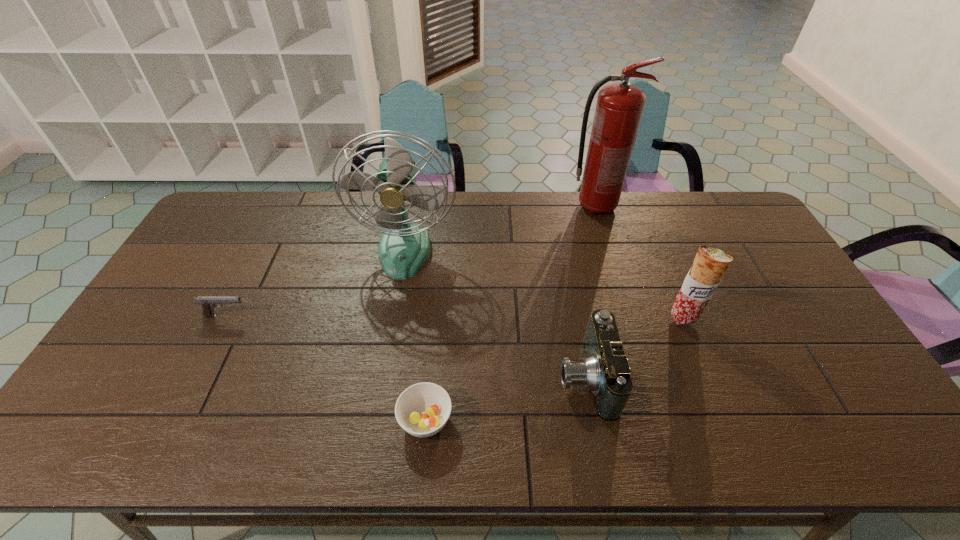
Identify the location of fire extinguisher. The width and height of the screenshot is (960, 540). (619, 108).

This screenshot has height=540, width=960. I want to click on the farthest object, so pyautogui.click(x=619, y=108).

The image size is (960, 540). In order to click on the fifth shortest object in this screenshot , I will do `click(404, 247)`.

Identify the location of fan. Image resolution: width=960 pixels, height=540 pixels. (404, 247).

Identify the location of burrito. The image size is (960, 540). (710, 264).

What are the coordinates of `the third tallest object` in the screenshot? It's located at (710, 264).

Locate an element on the screen. camcorder is located at coordinates (605, 371).

This screenshot has height=540, width=960. What are the coordinates of `the fifth tallest object` in the screenshot? It's located at (208, 303).

You are a GUI agent. You are given a task and a screenshot of the screen. Output one action in this format:
    pyautogui.click(x=<x>, y=<y>)
    Task: Click on the leftmost object
    
    Given the screenshot: What is the action you would take?
    pyautogui.click(x=208, y=303)

The width and height of the screenshot is (960, 540). What are the coordinates of `the shortest object` in the screenshot? It's located at (422, 410).